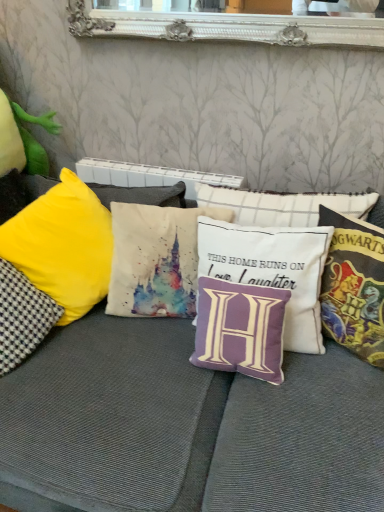
Question: Visually, is purple fabric pillow at center, which is counted as the 3th pillow, starting from the left, positioned to the left or to the right of velvet cushion at center?

Choices:
 (A) right
 (B) left

Answer: (A)

Question: Based on their sizes in the image, would you say purple fabric pillow at center, which is counted as the 3th pillow, starting from the left, is bigger or smaller than velvet cushion at center?

Choices:
 (A) small
 (B) big

Answer: (A)

Question: Which is farther from the purple fabric pillow at center, which is the 2th pillow from right to left?

Choices:
 (A) watercolor fabric castle at center, which is the 2th pillow in left-to-right order
 (B) velvet cushion at center
 (C) purple fabric pillow at center, which is the third pillow from right to left
 (D) multicolored fabric hogwarts-themed pillow at right, the first pillow from the right
 (E) yellow fabric pillow at left, the 5th pillow from the right

Answer: (E)

Question: Based on their relative distances, which object is farther from the velvet cushion at center?

Choices:
 (A) yellow fabric pillow at left, the 5th pillow from the right
 (B) watercolor fabric castle at center, which is the 2th pillow in left-to-right order
 (C) multicolored fabric hogwarts-themed pillow at right, the first pillow from the right
 (D) purple fabric pillow at center, which is counted as the 3th pillow, starting from the left
 (E) purple fabric pillow at center, which is the 2th pillow from right to left

Answer: (C)